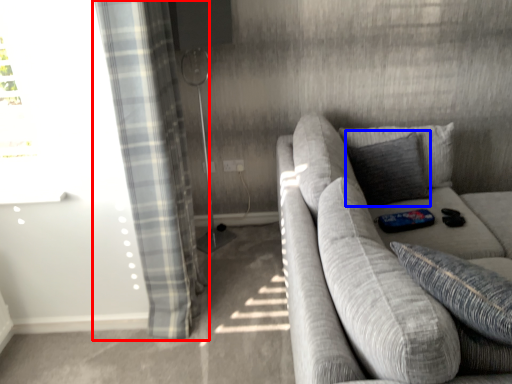
Question: Which object is closer to the camera taking this photo, curtain (highlighted by a red box) or pillow (highlighted by a blue box)?

Choices:
 (A) curtain
 (B) pillow

Answer: (A)